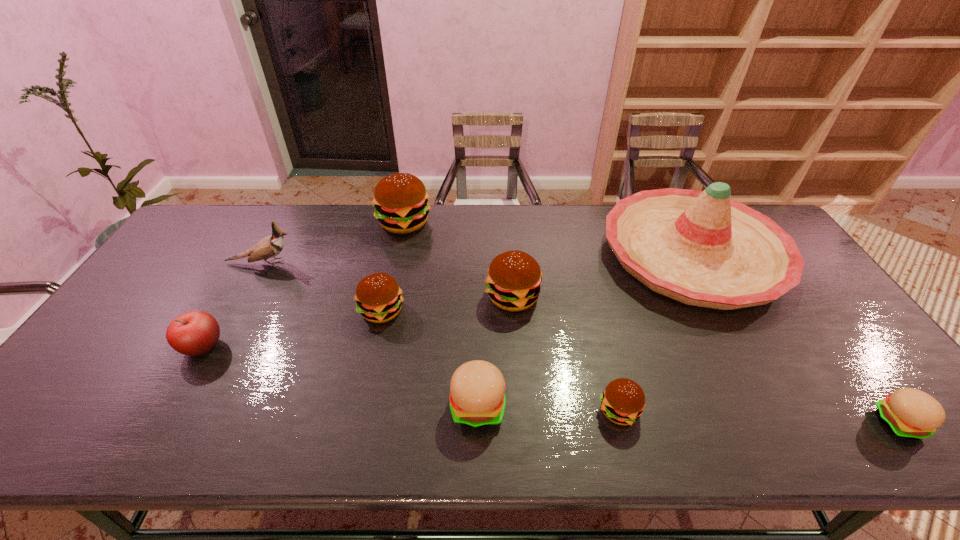
What are the coordinates of `the bigger beige hamburger` in the screenshot? It's located at (x=477, y=398).

Where is `the fifth hamburger from left to right`? the fifth hamburger from left to right is located at coordinates (623, 400).

Identify the location of the seventh object from left to right. (623, 400).

The height and width of the screenshot is (540, 960). Find the location of `the right beige hamburger`. the right beige hamburger is located at coordinates pos(910,413).

I want to click on the rightmost hamburger, so [910, 413].

You are a GUI agent. You are given a task and a screenshot of the screen. Output one action in this format:
    pyautogui.click(x=<x>, y=<y>)
    Task: Click on the vacant space located on the left of the red sombrero
    This screenshot has height=540, width=960.
    Given the screenshot: What is the action you would take?
    pyautogui.click(x=584, y=255)

You are a GUI agent. You are given a task and a screenshot of the screen. Output one action in this format:
    pyautogui.click(x=<x>, y=<y>)
    Task: Click on the vacant space situated 0.210m on the left of the farthest hamburger
    
    Given the screenshot: What is the action you would take?
    pyautogui.click(x=316, y=222)

The width and height of the screenshot is (960, 540). I want to click on free space located 0.290m at the face of the bird, so click(x=392, y=263).

Locate an element on the screen. blank space located 0.270m on the front of the third smallest brown hamburger is located at coordinates tap(521, 406).

At what (x,y) coordinates should I click in order to perform the action: click on vacant space located on the front of the second smallest brown hamburger. Please return your answer as a coordinate pair (x, y). This screenshot has height=540, width=960. Looking at the image, I should click on (354, 434).